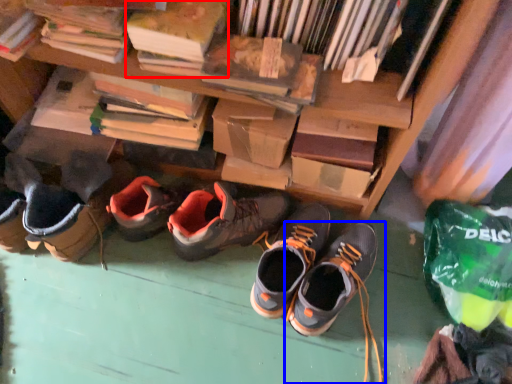
Question: Which object appears farthest to the camera in this image, paperback book (highlighted by a red box) or footwear (highlighted by a blue box)?

Choices:
 (A) paperback book
 (B) footwear

Answer: (B)